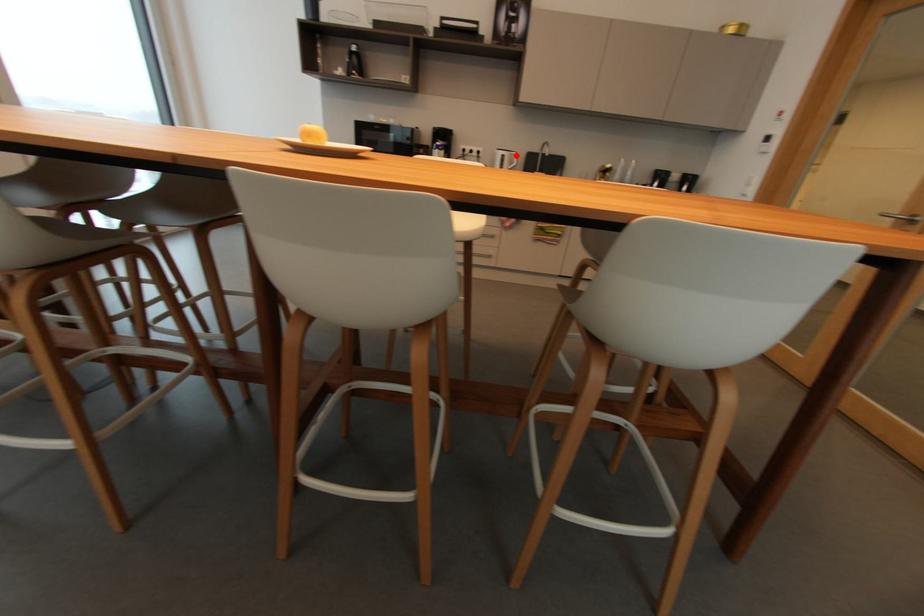
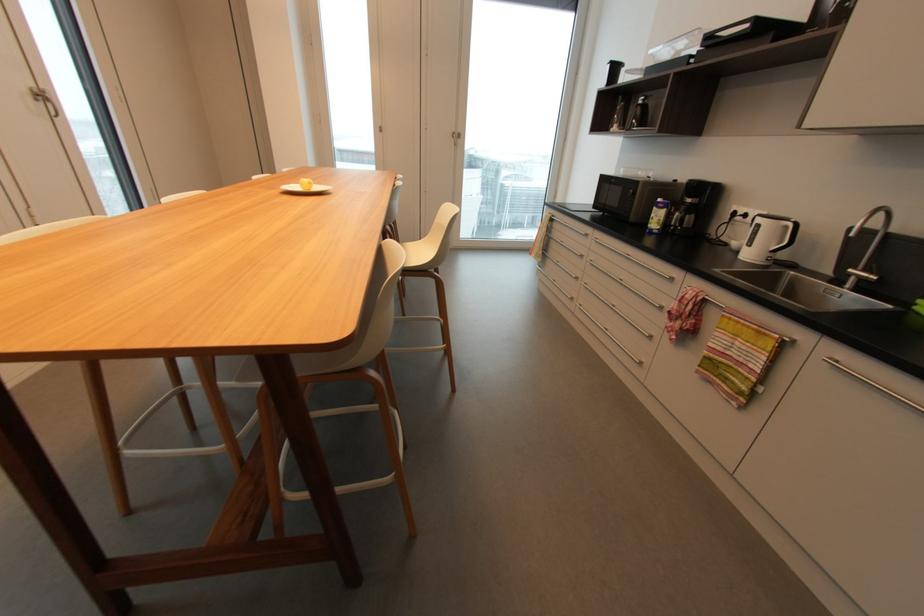
Find the pixel in the second image that matches the highlighted location in the first image.

(789, 227)